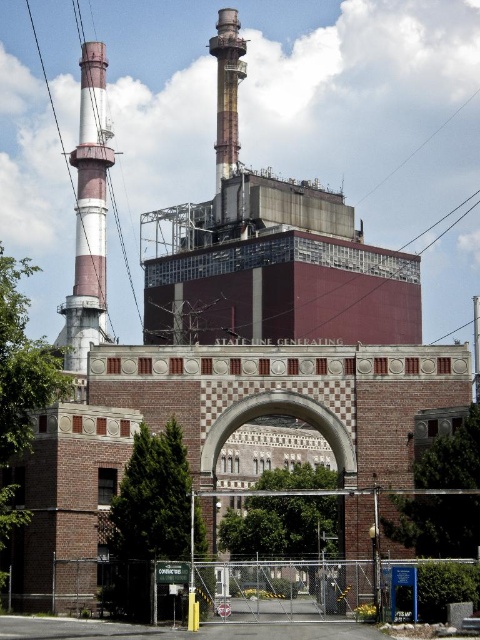
Question: Can you confirm if shiny metallic tower at upper center is positioned to the left of yellow corrugated plastic at center?

Choices:
 (A) no
 (B) yes

Answer: (B)

Question: Among these points, which one is nearest to the camera?

Choices:
 (A) (x=360, y=616)
 (B) (x=105, y=108)
 (C) (x=256, y=589)
 (D) (x=226, y=156)

Answer: (A)

Question: Is white-painted concrete chimney at left behind yellow corrugated plastic at center?

Choices:
 (A) no
 (B) yes

Answer: (B)

Question: Which object is closer to the camera taking this photo?

Choices:
 (A) white-painted concrete chimney at left
 (B) shiny metallic tower at upper center

Answer: (A)

Question: Which of the following is the closest to the observer?

Choices:
 (A) (264, 589)
 (B) (369, 602)
 (C) (98, 70)

Answer: (A)

Question: Can you confirm if white-painted concrete chimney at left is positioned below yellow corrugated plastic at center?

Choices:
 (A) yes
 (B) no

Answer: (B)